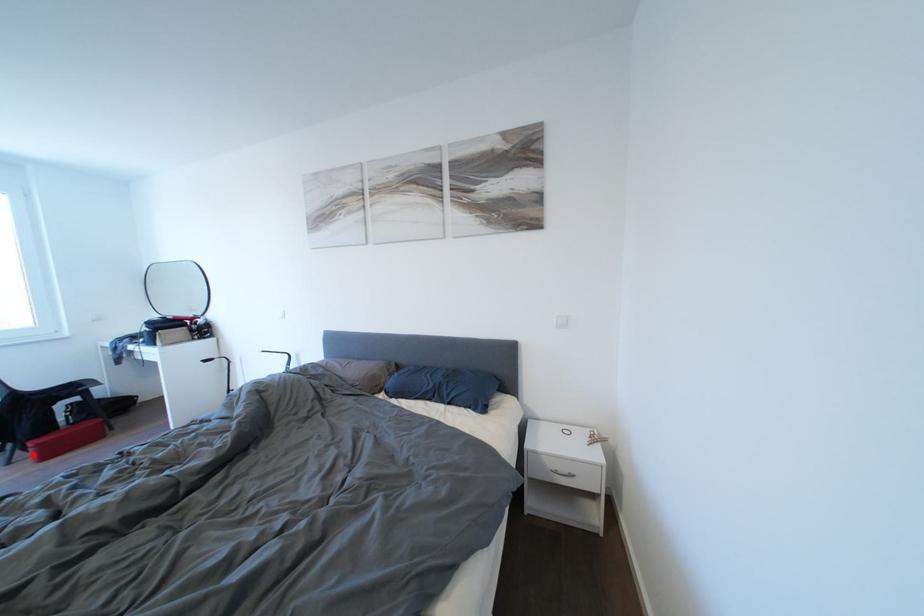
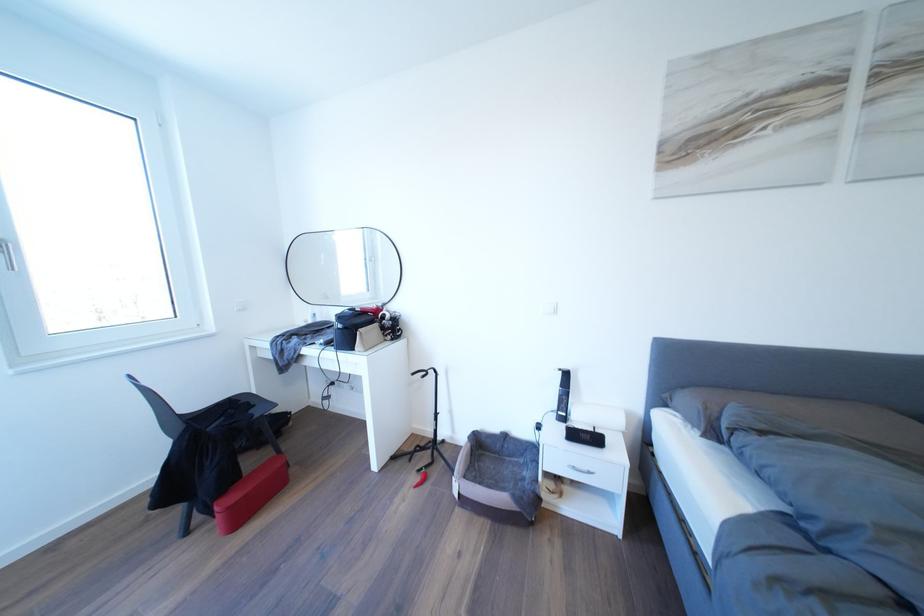
Locate, in the second image, the point that corresponds to the highlighted location in the first image.

(217, 519)